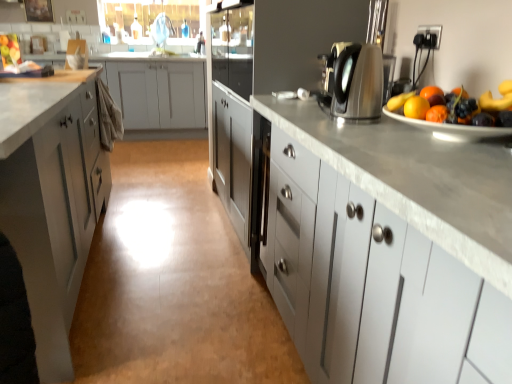
This screenshot has width=512, height=384. What do you see at coordinates (156, 46) in the screenshot?
I see `white glossy sink at upper center` at bounding box center [156, 46].

Find the location of a particular element. This screenshot has width=512, height=384. white matte cabinet at right, the first cabinetry viewed from the right is located at coordinates (370, 284).

This screenshot has height=384, width=512. Identify the location of satin silver kettle at upper right. (354, 80).

This screenshot has width=512, height=384. What do you see at coordinates (52, 199) in the screenshot? I see `white matte cabinet at left, positioned as the 2th cabinetry in right-to-left order` at bounding box center [52, 199].

Find the location of a particular element. satin nickel faucet at upper center is located at coordinates (161, 30).

Who is taller, white matte cabinet at left, marked as the second cabinetry in a left-to-right arrangement, or satin nickel faucet at upper center?

white matte cabinet at left, marked as the second cabinetry in a left-to-right arrangement, is taller.

In the scene shown: Can you confirm if white matte cabinet at left, the second cabinetry when ordered from back to front, is wider than satin nickel faucet at upper center?

Correct, the width of white matte cabinet at left, the second cabinetry when ordered from back to front, exceeds that of satin nickel faucet at upper center.

Can you confirm if white matte cabinet at left, the second cabinetry when ordered from back to front, is positioned to the right of satin nickel faucet at upper center?

In fact, white matte cabinet at left, the second cabinetry when ordered from back to front, is to the left of satin nickel faucet at upper center.

How many degrees apart are the facing directions of white matte cabinet at left, arranged as the second cabinetry when viewed from the front, and satin nickel faucet at upper center?

The angular difference between white matte cabinet at left, arranged as the second cabinetry when viewed from the front, and satin nickel faucet at upper center is 54.8 degrees.

Is white matte cabinet at left, marked as the first cabinetry in a left-to-right arrangement, taller or shorter than white matte cabinet at left, marked as the second cabinetry in a left-to-right arrangement?

Considering their sizes, white matte cabinet at left, marked as the first cabinetry in a left-to-right arrangement, has less height than white matte cabinet at left, marked as the second cabinetry in a left-to-right arrangement.

Based on their positions, is white matte cabinet at left, which is the third cabinetry in right-to-left order, located to the left or right of white matte cabinet at left, positioned as the 2th cabinetry in right-to-left order?

white matte cabinet at left, which is the third cabinetry in right-to-left order, is to the left of white matte cabinet at left, positioned as the 2th cabinetry in right-to-left order.

From the image's perspective, is white matte cabinet at left, marked as the first cabinetry in a left-to-right arrangement, beneath white matte cabinet at left, the second cabinetry when ordered from back to front?

No, from the image's perspective, white matte cabinet at left, marked as the first cabinetry in a left-to-right arrangement, is not below white matte cabinet at left, the second cabinetry when ordered from back to front.

Is white matte cabinet at right, placed as the 3th cabinetry when sorted from back to front, not inside satin nickel faucet at upper center?

Yes, white matte cabinet at right, placed as the 3th cabinetry when sorted from back to front, is outside of satin nickel faucet at upper center.

Does white matte cabinet at right, placed as the 3th cabinetry when sorted from back to front, have a lesser height compared to satin nickel faucet at upper center?

In fact, white matte cabinet at right, placed as the 3th cabinetry when sorted from back to front, may be taller than satin nickel faucet at upper center.

From a real-world perspective, is shiny ceramic plate at right above or below white matte cabinet at left, which is the third cabinetry in right-to-left order?

Clearly, from a real-world perspective, shiny ceramic plate at right is above white matte cabinet at left, which is the third cabinetry in right-to-left order.

In terms of height, does shiny ceramic plate at right look taller or shorter compared to white matte cabinet at left, the first cabinetry from the back?

shiny ceramic plate at right is shorter than white matte cabinet at left, the first cabinetry from the back.

Could you tell me if shiny ceramic plate at right is turned towards white matte cabinet at left, which is the third cabinetry in right-to-left order?

No, shiny ceramic plate at right is not facing towards white matte cabinet at left, which is the third cabinetry in right-to-left order.

Would you say satin silver kettle at upper right is to the left or to the right of white matte cabinet at left, positioned as the 2th cabinetry in right-to-left order, in the picture?

satin silver kettle at upper right is to the right of white matte cabinet at left, positioned as the 2th cabinetry in right-to-left order.

Could you measure the distance between satin silver kettle at upper right and white matte cabinet at left, positioned as the 2th cabinetry in right-to-left order?

They are 3.67 feet apart.

Is satin silver kettle at upper right outside of white matte cabinet at left, arranged as the second cabinetry when viewed from the front?

Absolutely, satin silver kettle at upper right is external to white matte cabinet at left, arranged as the second cabinetry when viewed from the front.

How many degrees apart are the facing directions of satin silver kettle at upper right and white matte cabinet at left, the second cabinetry when ordered from back to front?

There is a 46-degree angle between the facing directions of satin silver kettle at upper right and white matte cabinet at left, the second cabinetry when ordered from back to front.

Is satin nickel faucet at upper center oriented towards shiny ceramic plate at right?

No, satin nickel faucet at upper center is not oriented towards shiny ceramic plate at right.

Is the position of satin nickel faucet at upper center more distant than that of shiny ceramic plate at right?

Yes, it is.

Is satin nickel faucet at upper center bigger or smaller than shiny ceramic plate at right?

In the image, satin nickel faucet at upper center appears to be smaller than shiny ceramic plate at right.

How many degrees apart are the facing directions of satin nickel faucet at upper center and shiny ceramic plate at right?

satin nickel faucet at upper center and shiny ceramic plate at right are facing 55.6 degrees away from each other.

In the image, is white matte cabinet at right, the first cabinetry viewed from the right, positioned in front of or behind white matte cabinet at left, marked as the second cabinetry in a left-to-right arrangement?

Visually, white matte cabinet at right, the first cabinetry viewed from the right, is located in front of white matte cabinet at left, marked as the second cabinetry in a left-to-right arrangement.

Does point (436, 262) appear closer or farther from the camera than point (86, 164)?

Clearly, point (436, 262) is closer to the camera than point (86, 164).

Considering the sizes of objects white matte cabinet at right, placed as the 3th cabinetry when sorted from back to front, and white matte cabinet at left, arranged as the second cabinetry when viewed from the front, in the image provided, who is wider, white matte cabinet at right, placed as the 3th cabinetry when sorted from back to front, or white matte cabinet at left, arranged as the second cabinetry when viewed from the front,?

white matte cabinet at left, arranged as the second cabinetry when viewed from the front, is wider.

What's the angular difference between white matte cabinet at right, arranged as the first cabinetry when viewed from the front, and white matte cabinet at left, the second cabinetry when ordered from back to front,'s facing directions?

The angular difference between white matte cabinet at right, arranged as the first cabinetry when viewed from the front, and white matte cabinet at left, the second cabinetry when ordered from back to front, is 0.525 degrees.

The width and height of the screenshot is (512, 384). I want to click on faucet above the white matte cabinet at left, the second cabinetry when ordered from back to front (from the image's perspective), so click(161, 30).

The height and width of the screenshot is (384, 512). I want to click on the 1st cabinetry positioned below the white matte cabinet at left, positioned as the 2th cabinetry in right-to-left order (from a real-world perspective), so click(x=157, y=91).

Considering their positions, is shiny ceramic plate at right positioned further to white glossy sink at upper center than white matte cabinet at left, which is the third cabinetry in right-to-left order?

shiny ceramic plate at right is further to white glossy sink at upper center.

Looking at the image, which one is located further to white glossy sink at upper center, white matte cabinet at right, placed as the third cabinetry when sorted from left to right, or shiny ceramic plate at right?

shiny ceramic plate at right.

Looking at the image, which one is located further to satin nickel faucet at upper center, white glossy sink at upper center or satin silver kettle at upper right?

satin silver kettle at upper right.

Which object lies further to the anchor point white matte cabinet at left, marked as the first cabinetry in a left-to-right arrangement, shiny ceramic plate at right or white matte cabinet at left, arranged as the second cabinetry when viewed from the front?

shiny ceramic plate at right lies further to white matte cabinet at left, marked as the first cabinetry in a left-to-right arrangement, than the other object.

Which object lies further to the anchor point white matte cabinet at left, the first cabinetry from the back, satin nickel faucet at upper center or white matte cabinet at right, placed as the third cabinetry when sorted from left to right?

Based on the image, white matte cabinet at right, placed as the third cabinetry when sorted from left to right, appears to be further to white matte cabinet at left, the first cabinetry from the back.

Based on their spatial positions, is white matte cabinet at right, placed as the 3th cabinetry when sorted from back to front, or white matte cabinet at left, marked as the first cabinetry in a left-to-right arrangement, further from shiny ceramic plate at right?

Based on the image, white matte cabinet at left, marked as the first cabinetry in a left-to-right arrangement, appears to be further to shiny ceramic plate at right.

Considering their positions, is white matte cabinet at left, marked as the first cabinetry in a left-to-right arrangement, positioned closer to shiny ceramic plate at right than satin silver kettle at upper right?

satin silver kettle at upper right is closer to shiny ceramic plate at right.

Which object lies further to the anchor point shiny ceramic plate at right, white matte cabinet at left, marked as the first cabinetry in a left-to-right arrangement, or satin nickel faucet at upper center?

Among the two, satin nickel faucet at upper center is located further to shiny ceramic plate at right.

You are a GUI agent. You are given a task and a screenshot of the screen. Output one action in this format:
    pyautogui.click(x=<x>, y=<y>)
    Task: Click on the faucet positioned between shiny ceramic plate at right and white glossy sink at upper center from near to far
    
    Given the screenshot: What is the action you would take?
    pyautogui.click(x=161, y=30)

Locate an element on the screen. The image size is (512, 384). cabinetry located between satin silver kettle at upper right and white glossy sink at upper center in the depth direction is located at coordinates (157, 91).

At what (x,y) coordinates should I click in order to perform the action: click on cabinetry positioned between white matte cabinet at left, marked as the second cabinetry in a left-to-right arrangement, and satin nickel faucet at upper center from near to far. Please return your answer as a coordinate pair (x, y). This screenshot has height=384, width=512. Looking at the image, I should click on click(x=157, y=91).

You are a GUI agent. You are given a task and a screenshot of the screen. Output one action in this format:
    pyautogui.click(x=<x>, y=<y>)
    Task: Click on the home appliance between shiny ceramic plate at right and satin nickel faucet at upper center in the front-back direction
    Image resolution: width=512 pixels, height=384 pixels.
    Given the screenshot: What is the action you would take?
    pyautogui.click(x=354, y=80)